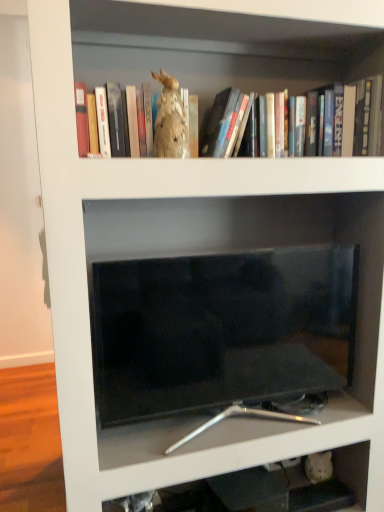
Where is `black glossy tv at center`? The height and width of the screenshot is (512, 384). black glossy tv at center is located at coordinates (251, 251).

I want to click on matte gold statue at upper center, so click(x=237, y=84).

From the image's perspective, is matte gold statue at upper center beneath black glossy tv at center?

Answer: No, from the image's perspective, matte gold statue at upper center is not below black glossy tv at center.

Identify the location of book above the black glossy tv at center (from a real-world perspective). This screenshot has width=384, height=512. (237, 84).

Can you confirm if matte gold statue at upper center is shorter than black glossy tv at center?

Yes, matte gold statue at upper center is shorter than black glossy tv at center.

I want to click on book on the right side of beige fabric rabbit at upper center, so click(237, 84).

Looking at this image, considering the relative sizes of beige fabric rabbit at upper center and matte gold statue at upper center in the image provided, is beige fabric rabbit at upper center bigger than matte gold statue at upper center?

No.

Which of these two, beige fabric rabbit at upper center or matte gold statue at upper center, is wider?

matte gold statue at upper center is wider.

Based on the photo, can you confirm if beige fabric rabbit at upper center is positioned to the left of matte gold statue at upper center?

Yes.

From the picture: Is black glossy tv at center at the right side of matte gold statue at upper center?

Yes, black glossy tv at center is to the right of matte gold statue at upper center.

Would you say black glossy tv at center contains matte gold statue at upper center?

No, matte gold statue at upper center is not inside black glossy tv at center.

Who is smaller, black glossy tv at center or matte gold statue at upper center?

matte gold statue at upper center.

In the image, is beige fabric rabbit at upper center positioned in front of or behind black glossy tv at center?

beige fabric rabbit at upper center is in front of black glossy tv at center.

Can you confirm if beige fabric rabbit at upper center is thinner than black glossy tv at center?

Yes, beige fabric rabbit at upper center is thinner than black glossy tv at center.

Can you confirm if beige fabric rabbit at upper center is smaller than black glossy tv at center?

Yes.

Can we say beige fabric rabbit at upper center lies outside black glossy tv at center?

Yes, beige fabric rabbit at upper center is located beyond the bounds of black glossy tv at center.

Which is in front, point (355, 362) or point (159, 96)?

Positioned in front is point (159, 96).

Is black glossy tv at center in front of beige fabric rabbit at upper center?

No, the depth of black glossy tv at center is greater than that of beige fabric rabbit at upper center.

Does black glossy tv at center turn towards beige fabric rabbit at upper center?

No.

Is black glossy tv at center taller or shorter than beige fabric rabbit at upper center?

Considering their sizes, black glossy tv at center has more height than beige fabric rabbit at upper center.

Considering the sizes of objects matte gold statue at upper center and beige fabric rabbit at upper center in the image provided, who is wider, matte gold statue at upper center or beige fabric rabbit at upper center?

With larger width is matte gold statue at upper center.

Which is closer, (144, 74) or (159, 141)?

Point (144, 74) is farther from the camera than point (159, 141).

Can beige fabric rabbit at upper center be found inside matte gold statue at upper center?

Absolutely, beige fabric rabbit at upper center is inside matte gold statue at upper center.

The image size is (384, 512). In the image, there is a matte gold statue at upper center. In order to click on animal below it (from the image's perspective) in this screenshot , I will do `click(170, 121)`.

The width and height of the screenshot is (384, 512). In the image, there is a matte gold statue at upper center. In order to click on shelf below it (from a real-world perspective) in this screenshot , I will do `click(251, 251)`.

Where is `animal behind the matte gold statue at upper center`? animal behind the matte gold statue at upper center is located at coordinates coord(170,121).

Considering their positions, is matte gold statue at upper center positioned further to black glossy tv at center than beige fabric rabbit at upper center?

beige fabric rabbit at upper center is positioned further to the anchor black glossy tv at center.

Looking at the image, which one is located further to matte gold statue at upper center, beige fabric rabbit at upper center or black glossy tv at center?

Based on the image, black glossy tv at center appears to be further to matte gold statue at upper center.

From the image, which object appears to be nearer to matte gold statue at upper center, black glossy tv at center or beige fabric rabbit at upper center?

beige fabric rabbit at upper center.

From the picture: From the image, which object appears to be farther from beige fabric rabbit at upper center, black glossy tv at center or matte gold statue at upper center?

The object further to beige fabric rabbit at upper center is black glossy tv at center.

From the image, which object appears to be farther from beige fabric rabbit at upper center, matte gold statue at upper center or black glossy tv at center?

black glossy tv at center.

Based on their spatial positions, is beige fabric rabbit at upper center or matte gold statue at upper center further from black glossy tv at center?

The object further to black glossy tv at center is beige fabric rabbit at upper center.

Locate an element on the screen. animal between matte gold statue at upper center and black glossy tv at center in the vertical direction is located at coordinates (170, 121).